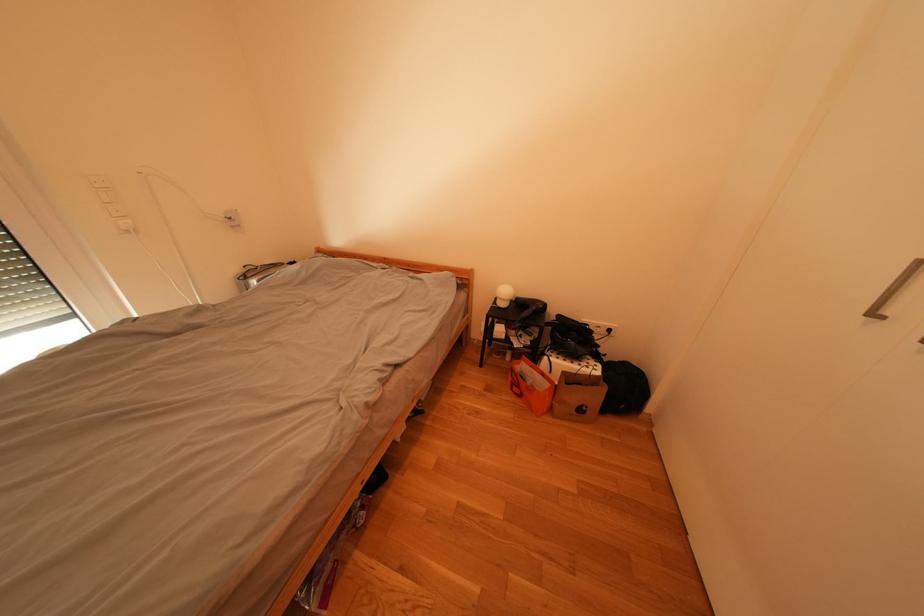
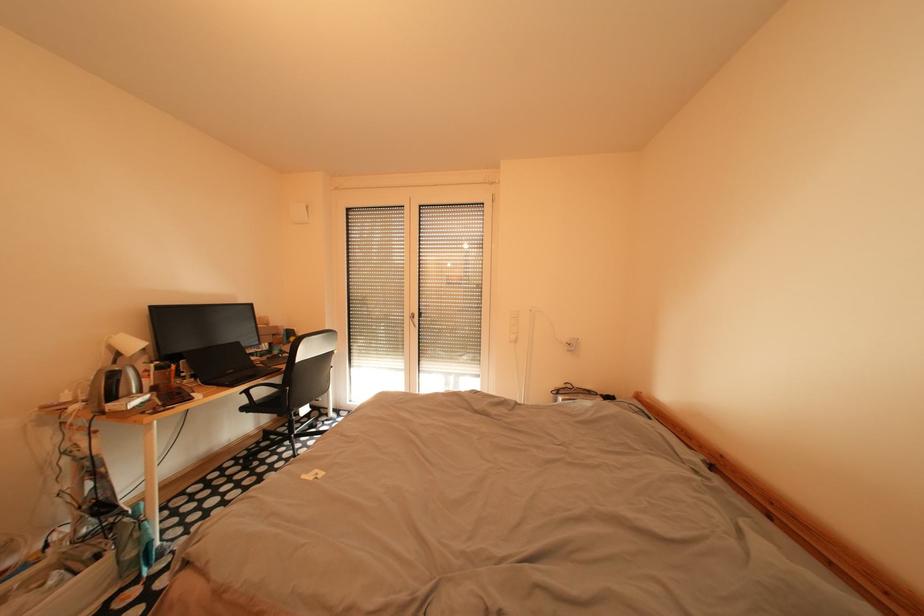
Question: The images are taken continuously from a first-person perspective. In which direction is your viewpoint rotating?

Choices:
 (A) Left
 (B) Right
 (C) Up
 (D) Down

Answer: (A)